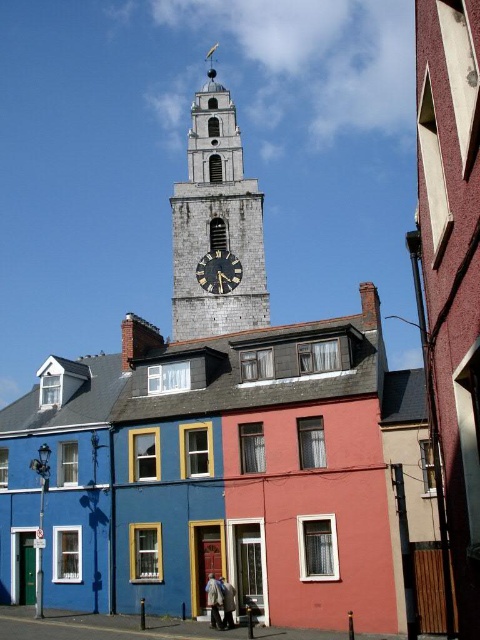
Question: Does silver metallic clock tower at upper center have a greater width compared to black polished clock at center?

Choices:
 (A) yes
 (B) no

Answer: (A)

Question: Which of the following is the closest to the observer?

Choices:
 (A) silver metallic clock tower at upper center
 (B) black polished clock at center

Answer: (A)

Question: Is silver metallic clock tower at upper center above black polished clock at center?

Choices:
 (A) no
 (B) yes

Answer: (B)

Question: Does silver metallic clock tower at upper center appear on the left side of black polished clock at center?

Choices:
 (A) no
 (B) yes

Answer: (B)